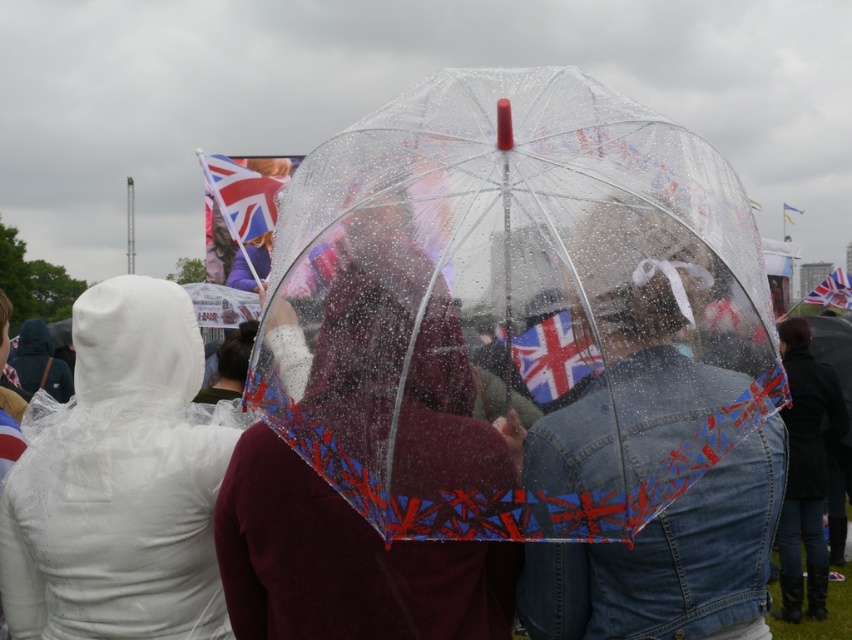
Does white translucent raincoat at left have a greater width compared to union jack flag at upper center?

Incorrect, white translucent raincoat at left's width does not surpass union jack flag at upper center's.

What do you see at coordinates (119, 483) in the screenshot?
I see `white translucent raincoat at left` at bounding box center [119, 483].

Describe the element at coordinates (119, 483) in the screenshot. I see `white translucent raincoat at left` at that location.

This screenshot has width=852, height=640. Find the location of `white translucent raincoat at left`. white translucent raincoat at left is located at coordinates (119, 483).

In the scene shown: Can you confirm if transparent plastic umbrella at center is wider than union jack flag at upper center?

Incorrect, transparent plastic umbrella at center's width does not surpass union jack flag at upper center's.

Looking at this image, who is more forward, (344,337) or (827,298)?

Point (344,337) is in front.

Who is more distant from viewer, (517, 484) or (836, 272)?

The point (836, 272) is more distant.

Where is `transparent plastic umbrella at center`? Image resolution: width=852 pixels, height=640 pixels. transparent plastic umbrella at center is located at coordinates (514, 308).

Between transparent plastic umbrella at center and union jack fabric flag at center, which one appears on the left side from the viewer's perspective?

Positioned to the left is transparent plastic umbrella at center.

Who is lower down, transparent plastic umbrella at center or union jack fabric flag at center?

union jack fabric flag at center is below.

Identify the location of transparent plastic umbrella at center. (514, 308).

You are a GUI agent. You are given a task and a screenshot of the screen. Output one action in this format:
    pyautogui.click(x=<x>, y=<y>)
    Task: Click on the transparent plastic umbrella at center
    This screenshot has height=640, width=852.
    Given the screenshot: What is the action you would take?
    pyautogui.click(x=514, y=308)